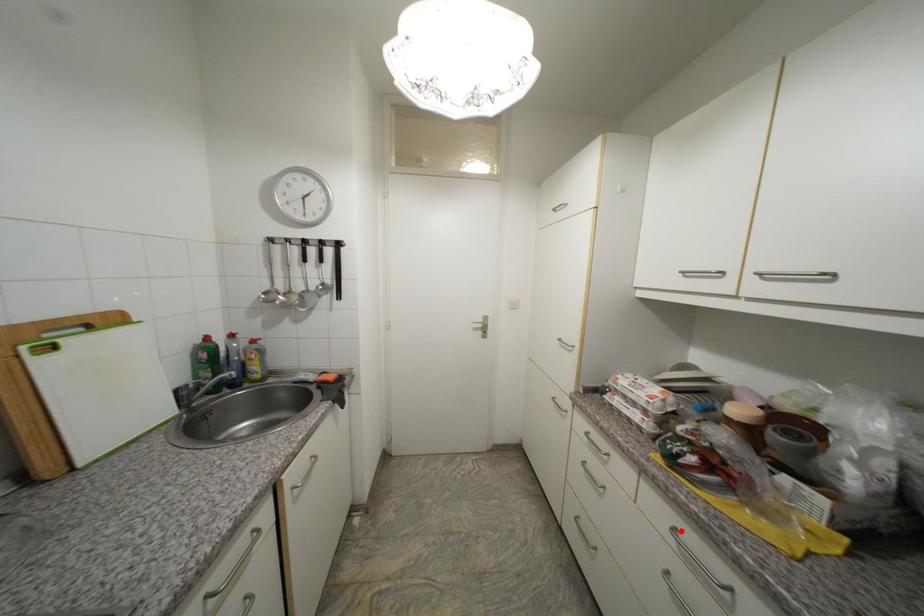
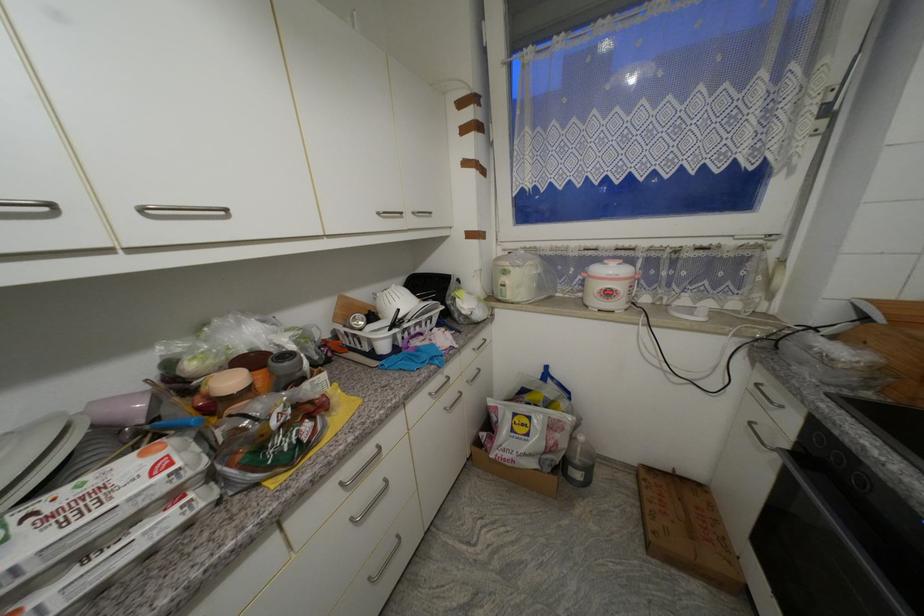
Locate, in the second image, the point that corresponds to the highlighted location in the first image.

(347, 485)